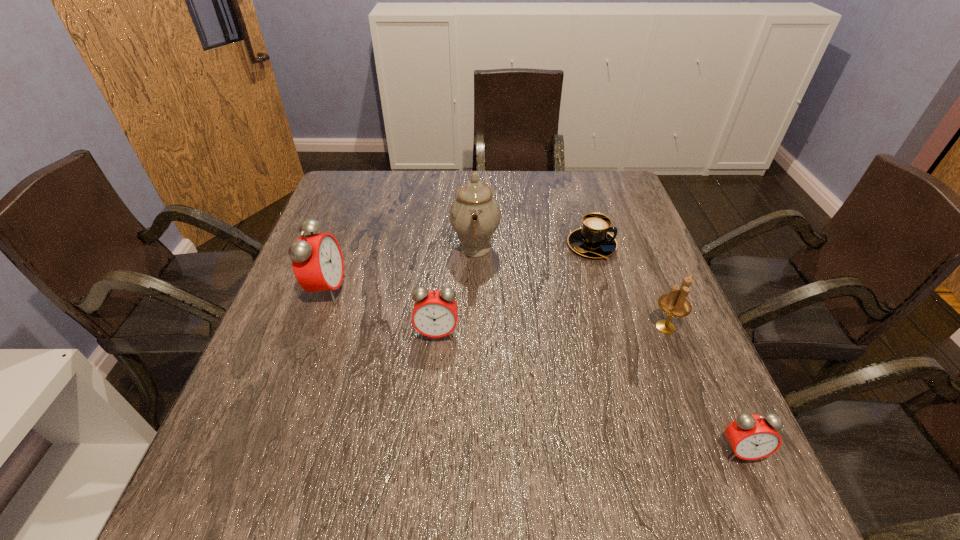
At what (x,y) coordinates should I click in order to perform the action: click on free space located 0.310m on the front-facing side of the tallest alarm clock. Please return your answer as a coordinate pair (x, y). The image size is (960, 540). Looking at the image, I should click on (473, 290).

The width and height of the screenshot is (960, 540). I want to click on free space located on the front-facing side of the second alarm clock from left to right, so click(x=432, y=393).

Image resolution: width=960 pixels, height=540 pixels. What are the coordinates of `vacant space located 0.100m on the back of the shortest object` in the screenshot? It's located at (582, 210).

This screenshot has height=540, width=960. I want to click on free space located 0.200m on the spout of the chinaware, so click(574, 247).

At what (x,y) coordinates should I click in order to perform the action: click on free space located 0.130m on the back of the candle holder. Please return your answer as a coordinate pair (x, y). Looking at the image, I should click on [645, 276].

At what (x,y) coordinates should I click in order to perform the action: click on object that is at the near edge. Please return your answer as a coordinate pair (x, y). The image size is (960, 540). Looking at the image, I should click on (751, 437).

Locate an element on the screen. The image size is (960, 540). object positioned at the left edge is located at coordinates pos(317,261).

Identify the location of alarm clock situated at the right edge. This screenshot has width=960, height=540. click(x=751, y=437).

This screenshot has width=960, height=540. In order to click on cappuccino that is at the right edge in this screenshot , I will do `click(592, 240)`.

You are a GUI agent. You are given a task and a screenshot of the screen. Output one action in this format:
    pyautogui.click(x=<x>, y=<y>)
    Task: Click on the candle holder that is at the right edge
    The width and height of the screenshot is (960, 540).
    Given the screenshot: What is the action you would take?
    pyautogui.click(x=675, y=304)